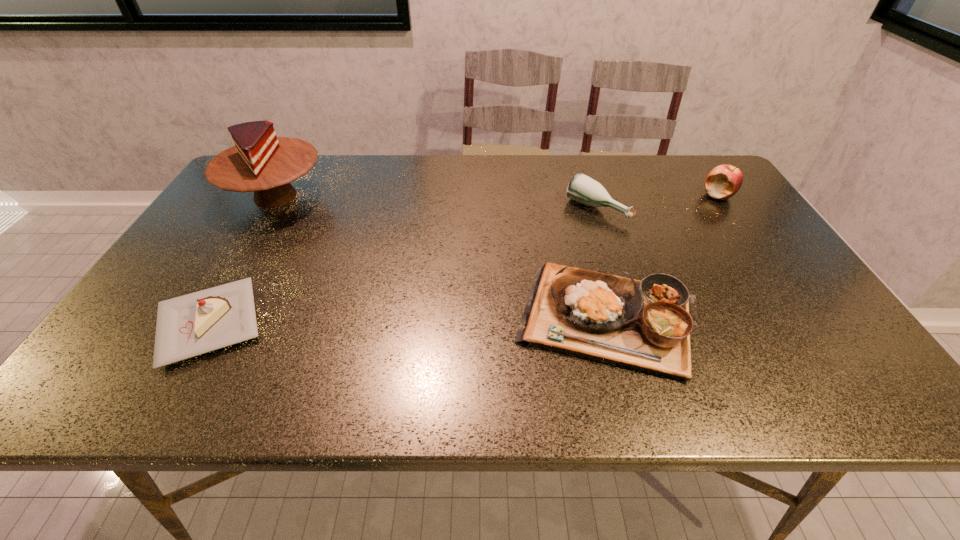
At what (x,y) coordinates should I click in order to perform the action: click on free spot that satisfies the following two spatial constraints: 1. on the back side of the bottle; 2. on the right side of the platter. Please return your answer as a coordinate pair (x, y). This screenshot has height=540, width=960. Looking at the image, I should click on (579, 209).